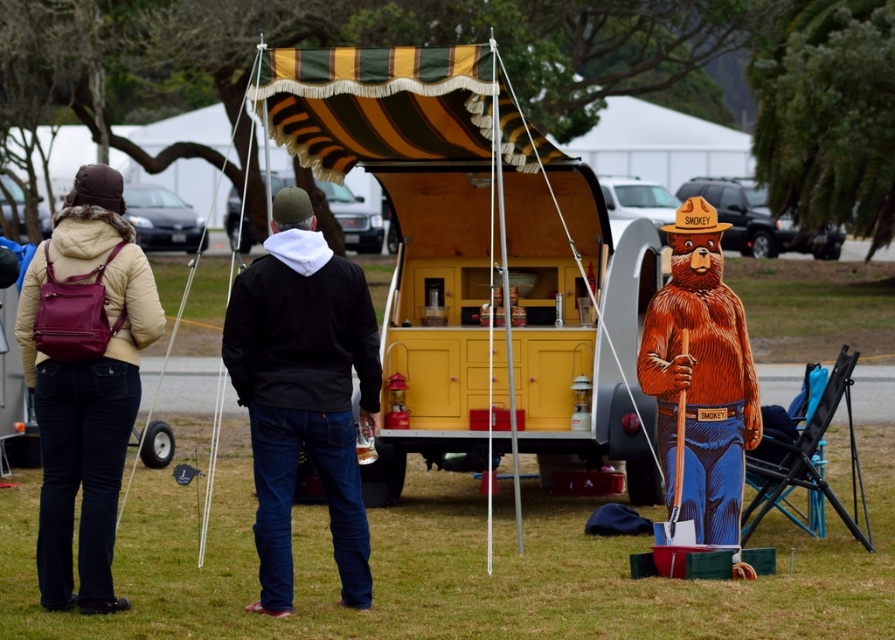
Measure the distance between yellow wood food truck at center and camera.

A distance of 14.01 meters exists between yellow wood food truck at center and camera.

What do you see at coordinates (478, 259) in the screenshot? I see `yellow wood food truck at center` at bounding box center [478, 259].

Locate an element on the screen. This screenshot has width=895, height=640. yellow wood food truck at center is located at coordinates (478, 259).

Is yellow wood food truck at center bigger than matte brown backpack at left?

Indeed, yellow wood food truck at center has a larger size compared to matte brown backpack at left.

Who is higher up, yellow wood food truck at center or matte brown backpack at left?

Positioned higher is yellow wood food truck at center.

What do you see at coordinates (478, 259) in the screenshot? I see `yellow wood food truck at center` at bounding box center [478, 259].

At what (x,y) coordinates should I click in order to perform the action: click on yellow wood food truck at center. Please return your answer as a coordinate pair (x, y). This screenshot has width=895, height=640. Looking at the image, I should click on (478, 259).

Is matte brown backpack at left smaller than wooden bear at center?

Yes, matte brown backpack at left is smaller than wooden bear at center.

Does matte brown backpack at left appear over wooden bear at center?

Indeed, matte brown backpack at left is positioned over wooden bear at center.

At what (x,y) coordinates should I click in order to perform the action: click on matte brown backpack at left. Please return your answer as a coordinate pair (x, y). The width and height of the screenshot is (895, 640). Looking at the image, I should click on (84, 380).

Identify the location of matte brown backpack at left. The height and width of the screenshot is (640, 895). (84, 380).